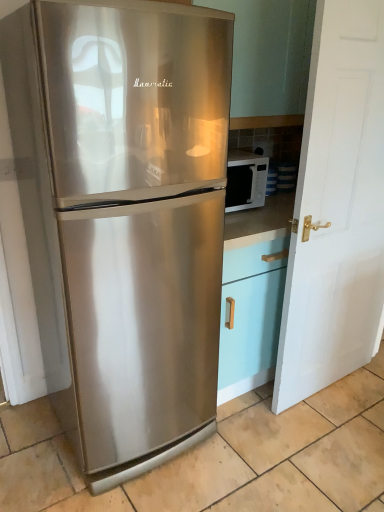
Locate an element on the screen. This screenshot has height=512, width=384. unoccupied region to the right of stainless steel refrigerator at left is located at coordinates (259, 457).